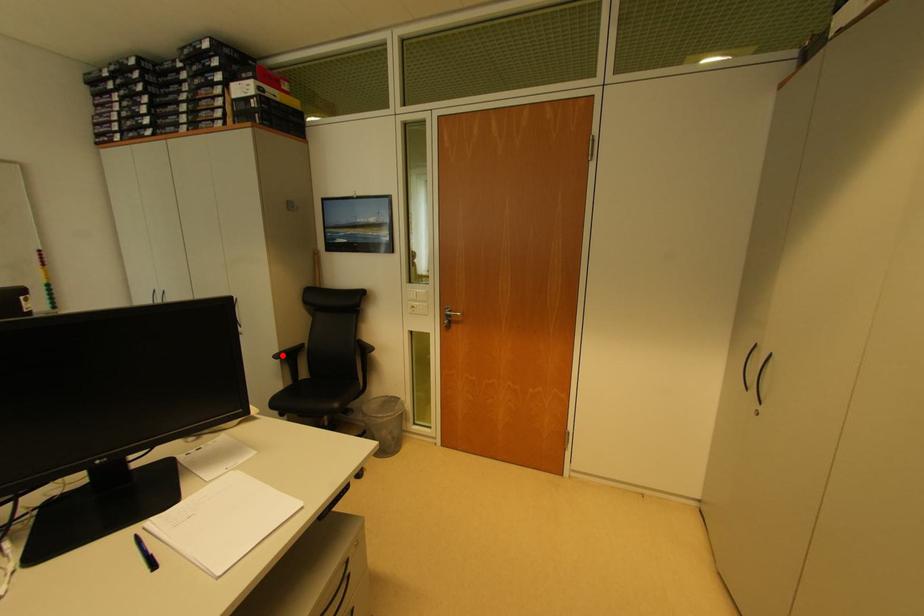
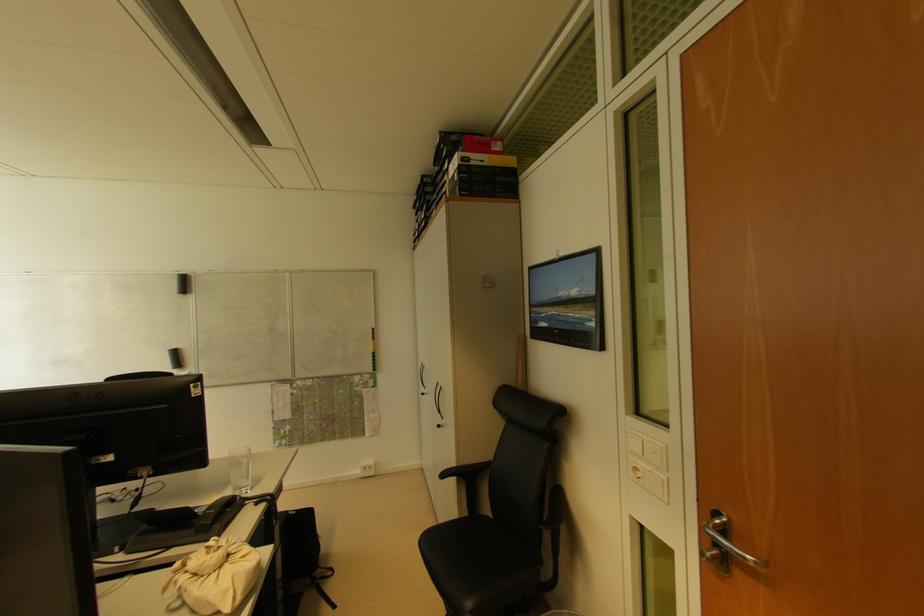
Find the pixel in the second image that matches the highlighted location in the first image.

(458, 469)